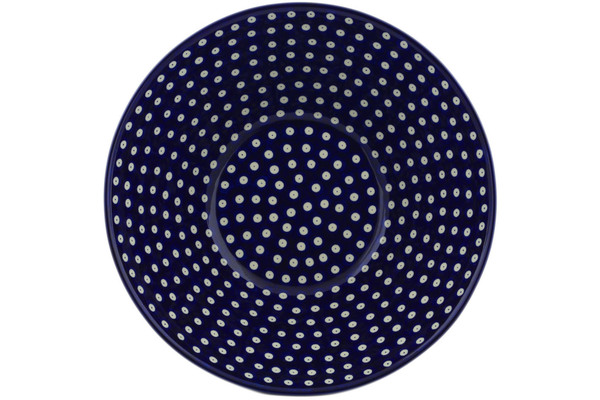
Locate an element on the screen. The image size is (600, 400). inside rim of plate is located at coordinates (273, 123).